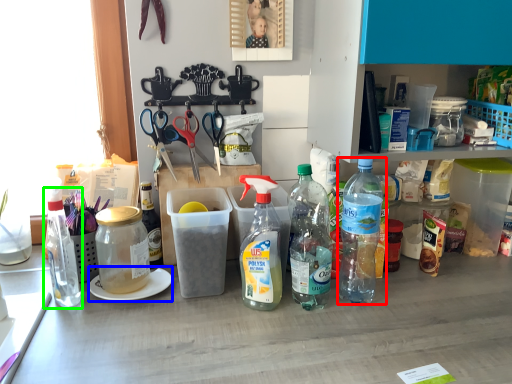
Question: Estimate the real-world distances between objects in this image. Which object is farther from bottle (highlighted by a red box), plate (highlighted by a blue box) or bottle (highlighted by a green box)?

Choices:
 (A) plate
 (B) bottle

Answer: (B)